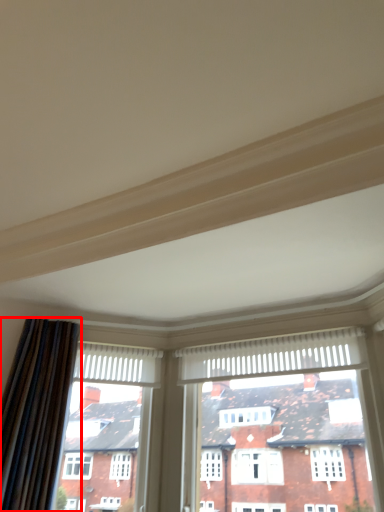
Question: In this image, where is curtain (annotated by the red box) located relative to window?

Choices:
 (A) right
 (B) left

Answer: (B)